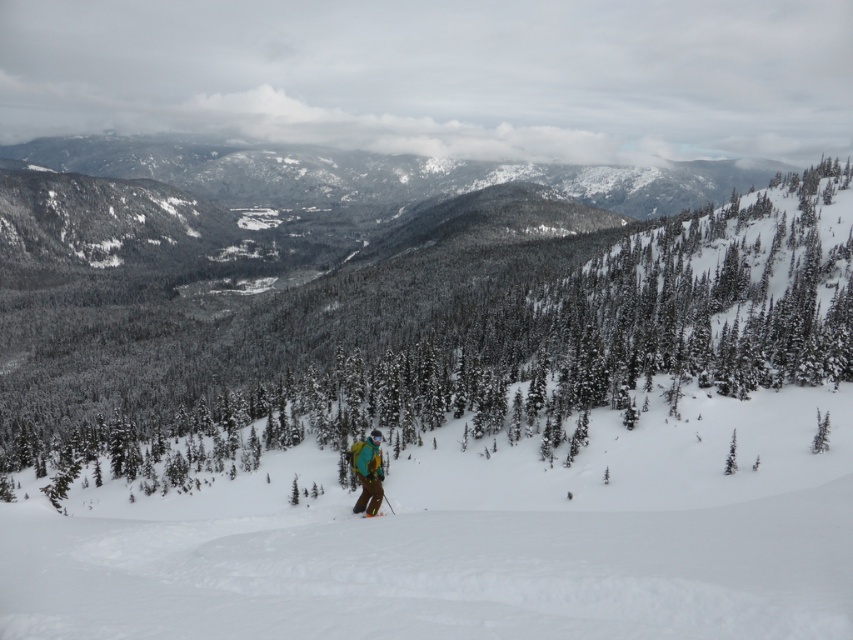
Question: Can you confirm if green matte tree at center is wider than white powder snow at center?

Choices:
 (A) yes
 (B) no

Answer: (A)

Question: Can you confirm if green matte tree at center is positioned to the left of white powder snow at center?

Choices:
 (A) no
 (B) yes

Answer: (B)

Question: Observing the image, what is the correct spatial positioning of green matte tree at center in reference to white powder snow at center?

Choices:
 (A) above
 (B) below

Answer: (A)

Question: Which of the following is the closest to the observer?

Choices:
 (A) teal fabric jacket at center
 (B) white powder snow at center

Answer: (B)

Question: Among these points, which one is farthest from the camera?

Choices:
 (A) (132, 568)
 (B) (357, 513)
 (C) (496, 294)

Answer: (C)

Question: Among these objects, which one is farthest from the camera?

Choices:
 (A) orange metallic ski at center
 (B) white powder snow at center

Answer: (A)